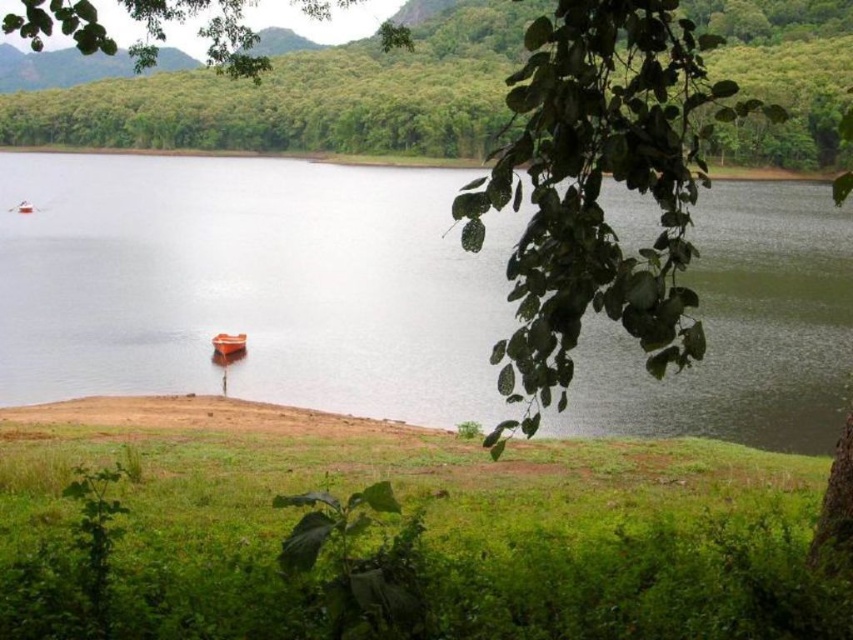
Question: Does clear water at center appear on the left side of green leafy tree at upper center?

Choices:
 (A) no
 (B) yes

Answer: (A)

Question: Does orange glossy boat at lower center have a lesser width compared to orange matte boat at center?

Choices:
 (A) yes
 (B) no

Answer: (B)

Question: Which point is closer to the camera?

Choices:
 (A) (28, 202)
 (B) (221, 353)

Answer: (B)

Question: Does green grass at lower center have a larger size compared to orange glossy boat at lower center?

Choices:
 (A) no
 (B) yes

Answer: (B)

Question: Estimate the real-world distances between objects in this image. Which object is closer to the green grass at lower center?

Choices:
 (A) green leafy tree at upper center
 (B) orange matte boat at center

Answer: (B)

Question: Which of the following is the farthest from the observer?

Choices:
 (A) (26, 200)
 (B) (148, 237)

Answer: (A)